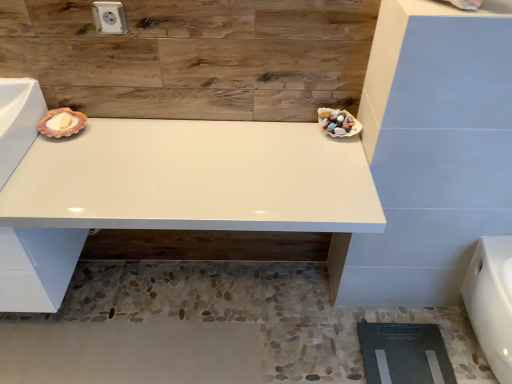
Identify the location of vacant area situated below white glossy vanity at center (from a real-world perspective). (158, 312).